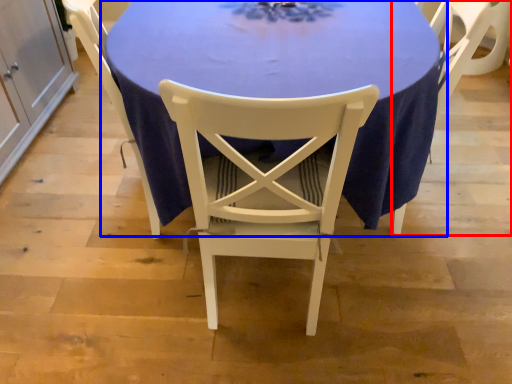
Question: Which object is closer to the camera taking this photo, chair (highlighted by a red box) or table (highlighted by a blue box)?

Choices:
 (A) chair
 (B) table

Answer: (B)